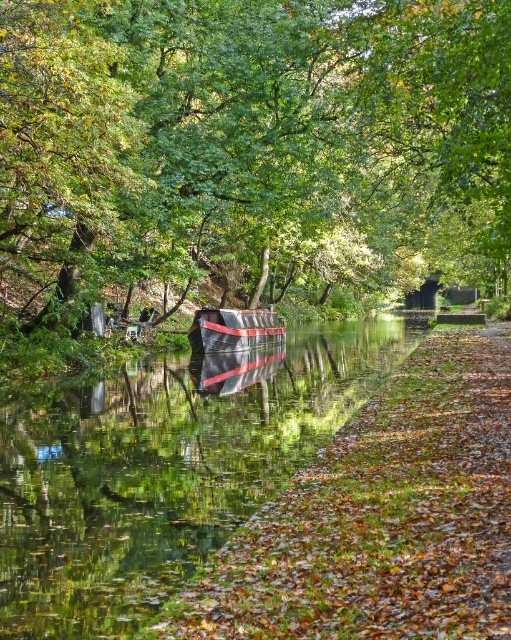
You are a photographer standing at the edge of the canal. You want to capture a photo that includes both the green glossy water at center and the metallic silver boat at center. Which object will appear larger in the photo?

The metallic silver boat at center will appear larger in the photo because it is taller than the green glossy water at center.